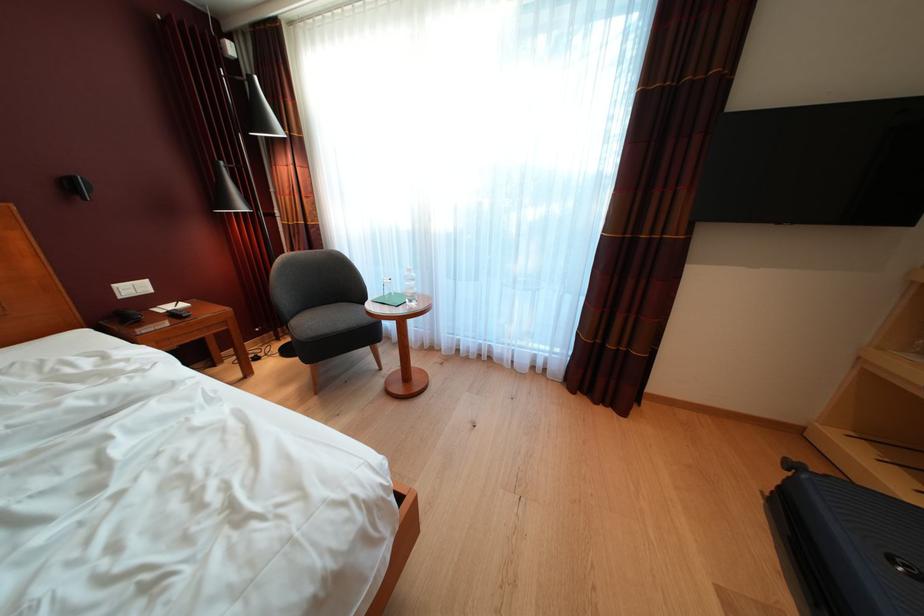
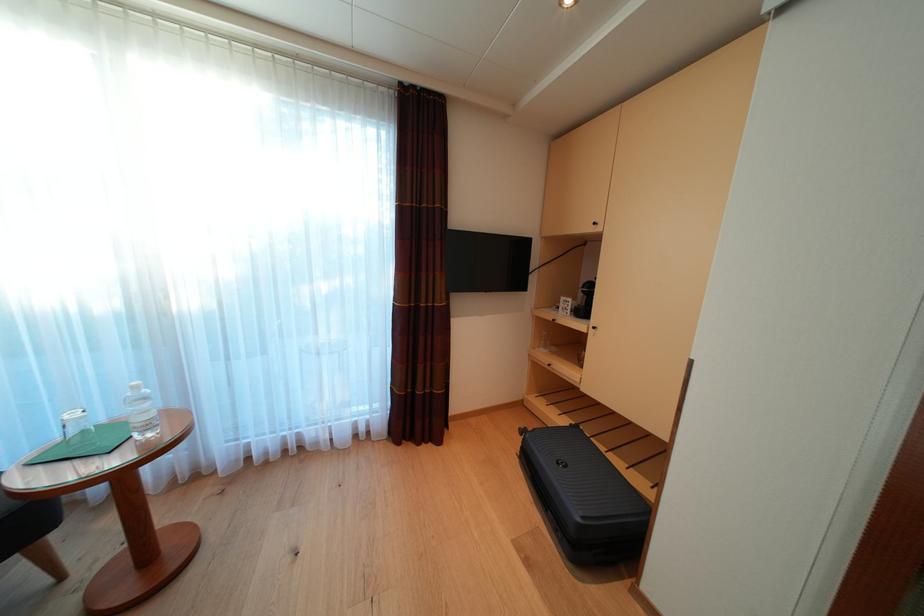
In the second image, find the point that corresponds to (379,339) in the first image.

(28, 531)